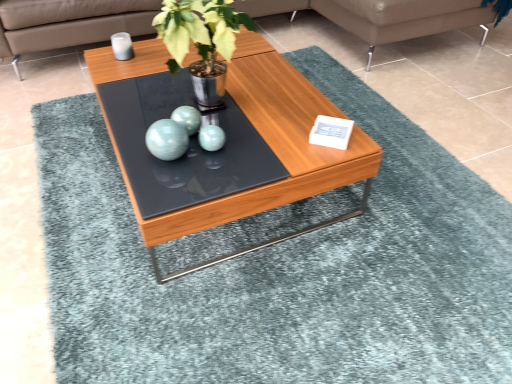
Question: In the image, is teal glossy sphere at center positioned in front of or behind metallic green plant at center?

Choices:
 (A) front
 (B) behind

Answer: (B)

Question: From a real-world perspective, relative to metallic green plant at center, is teal glossy sphere at center vertically above or below?

Choices:
 (A) above
 (B) below

Answer: (B)

Question: Considering the real-world distances, which object is farthest from the wooden coffee table at center?

Choices:
 (A) metallic green plant at center
 (B) leather couch at upper center
 (C) leather couch at upper right
 (D) teal glossy sphere at center

Answer: (B)

Question: Which is farther from the leather couch at upper center?

Choices:
 (A) teal glossy sphere at center
 (B) metallic green plant at center
 (C) leather couch at upper right
 (D) wooden coffee table at center

Answer: (A)